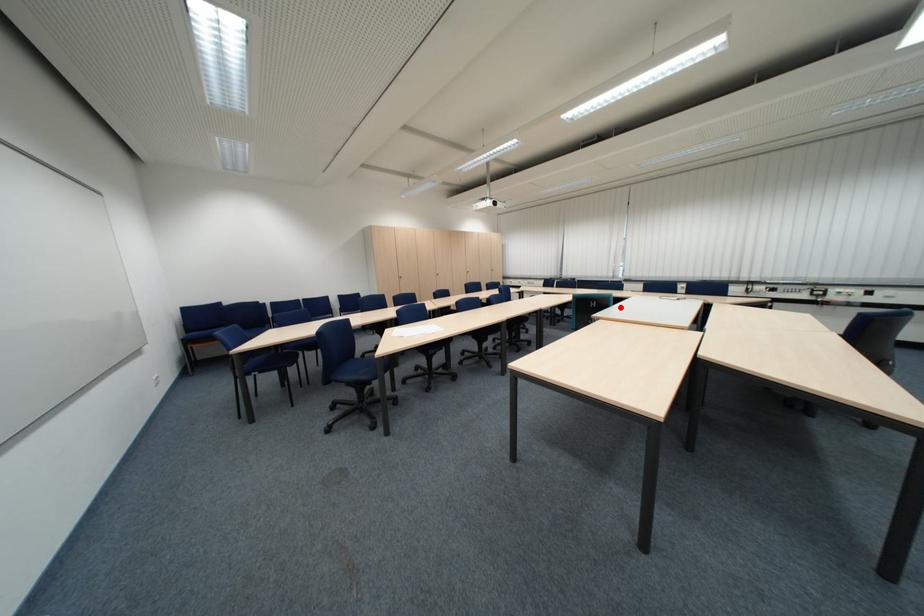
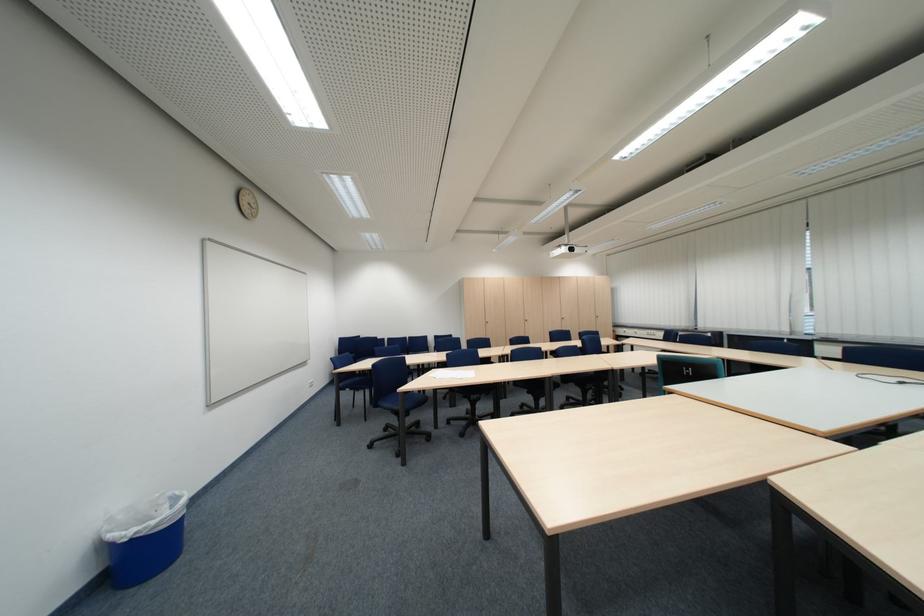
Locate, in the second image, the point that corresponds to the highlighted location in the first image.

(726, 378)